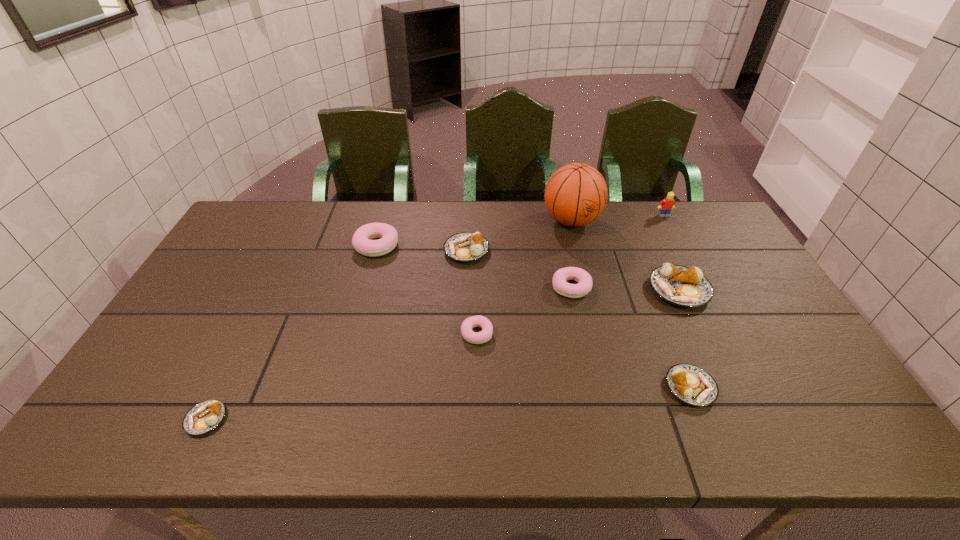
Find the location of a particular element. This screenshot has width=960, height=540. free space at the near edge is located at coordinates (412, 423).

Find the location of `vacant area at the left edge`. vacant area at the left edge is located at coordinates (237, 273).

At what (x,y) coordinates should I click in order to perform the action: click on free space at the right edge of the desktop. Please return your answer as a coordinate pair (x, y). Looking at the image, I should click on (713, 262).

Where is `free region at the far left corner of the desktop`? Image resolution: width=960 pixels, height=540 pixels. free region at the far left corner of the desktop is located at coordinates (291, 205).

Find the location of a particular element. blank space at the far right corner of the desktop is located at coordinates (697, 224).

Image resolution: width=960 pixels, height=540 pixels. Identify the location of vacant area that lies between the second farthest brown pastry and the smallest pink pastry. (578, 312).

At what (x,y) coordinates should I click in order to perform the action: click on vacant space in between the tallest object and the third biggest brown pastry. Please return your answer as a coordinate pair (x, y). The image size is (960, 540). Looking at the image, I should click on (631, 304).

In order to click on free space between the rightmost pink pastry and the leftmost object in this screenshot , I will do `click(389, 353)`.

You are a GUI agent. You are given a task and a screenshot of the screen. Output one action in this format:
    pyautogui.click(x=<x>, y=<y>)
    Task: Click on the free spot between the biggest pink pastry and the farthest brown pastry
    
    Given the screenshot: What is the action you would take?
    pyautogui.click(x=421, y=248)

Locate an element on the screen. Image resolution: width=960 pixels, height=540 pixels. vacant space in between the third nearest brown pastry and the Lego is located at coordinates (671, 253).